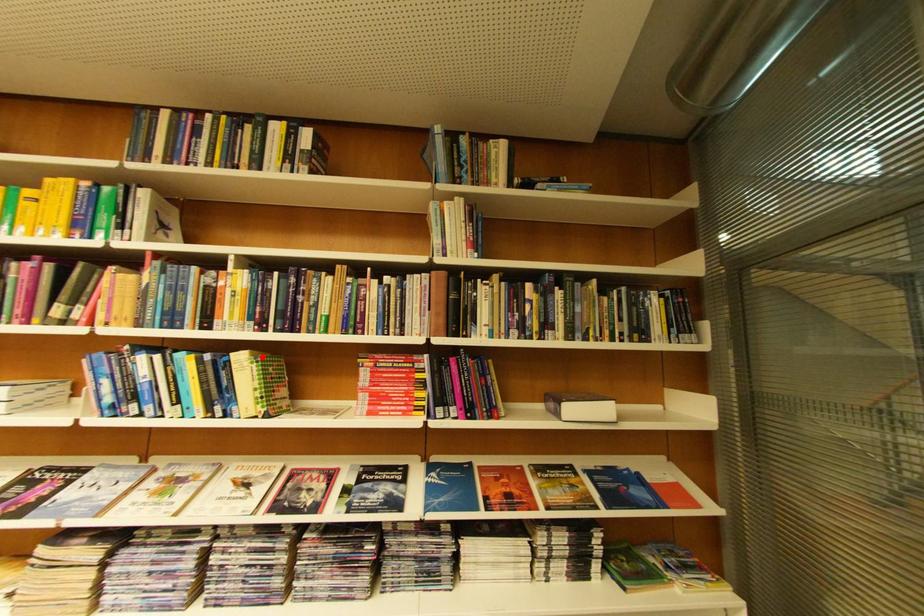
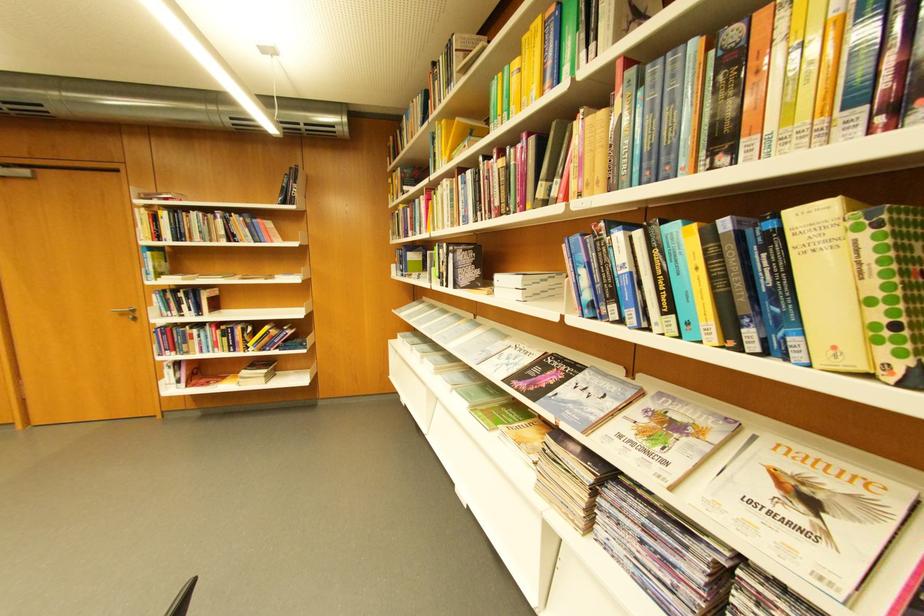
Find the pixel in the second image that matches the highlighted location in the first image.

(861, 209)